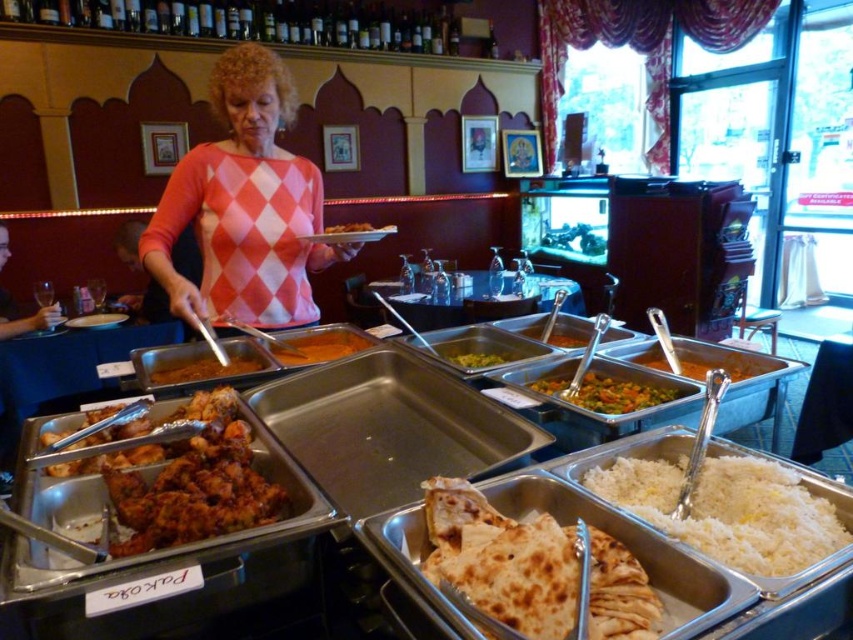
Is multicolored vegetables at center shorter than brown matte chicken at center?

Incorrect, multicolored vegetables at center's height does not fall short of brown matte chicken at center's.

Identify the location of multicolored vegetables at center. The image size is (853, 640). (618, 394).

Which is more to the left, pink diamond-patterned sweater at center or multicolored vegetables at center?

From the viewer's perspective, pink diamond-patterned sweater at center appears more on the left side.

Who is more forward, (239, 195) or (592, 410)?

Point (592, 410) is more forward.

The image size is (853, 640). Describe the element at coordinates (244, 205) in the screenshot. I see `pink diamond-patterned sweater at center` at that location.

The height and width of the screenshot is (640, 853). What are the coordinates of `pink diamond-patterned sweater at center` in the screenshot? It's located at (244, 205).

Can you confirm if white rice at center is bigger than green matte vegetable at center?

Indeed, white rice at center has a larger size compared to green matte vegetable at center.

Is point (675, 480) closer to viewer compared to point (479, 355)?

Yes, it is in front of point (479, 355).

Which is in front, point (735, 456) or point (468, 360)?

Point (735, 456) is in front.

Find the location of a particular element. white rice at center is located at coordinates point(728,509).